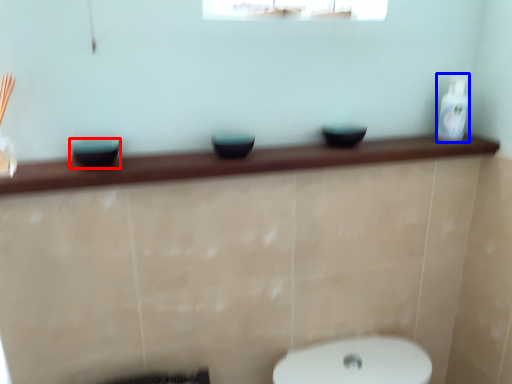
Question: Which object appears farthest to the camera in this image, basin (highlighted by a red box) or toiletry (highlighted by a blue box)?

Choices:
 (A) basin
 (B) toiletry

Answer: (B)